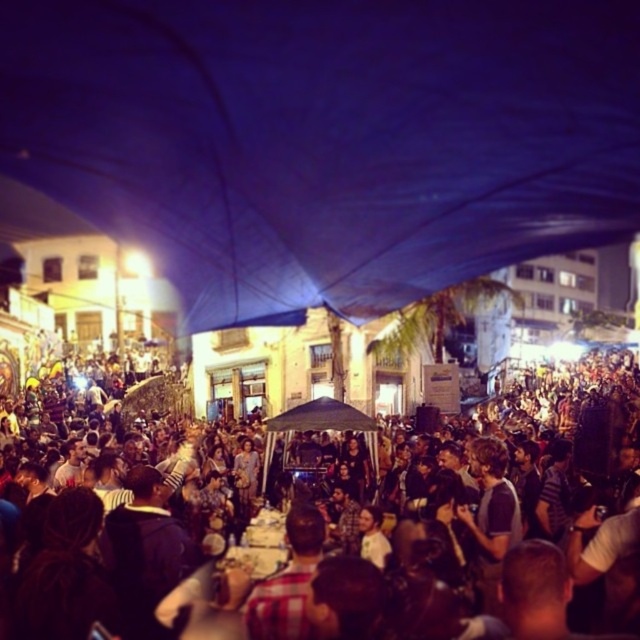
Between blue fabric canopy at upper center and multicolored fabric crowd at center, which one is positioned higher?

blue fabric canopy at upper center

Consider the image. Is blue fabric canopy at upper center below multicolored fabric crowd at center?

Actually, blue fabric canopy at upper center is above multicolored fabric crowd at center.

What do you see at coordinates (326, 140) in the screenshot? I see `blue fabric canopy at upper center` at bounding box center [326, 140].

The height and width of the screenshot is (640, 640). I want to click on blue fabric canopy at upper center, so click(326, 140).